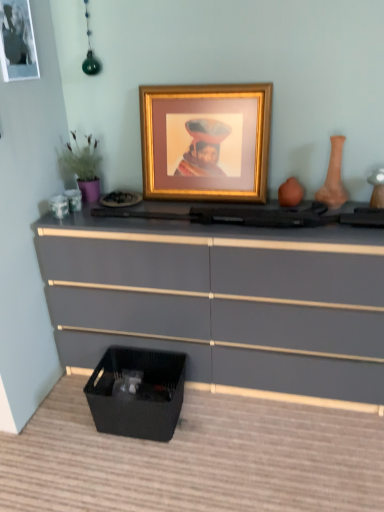
Image resolution: width=384 pixels, height=512 pixels. I want to click on unoccupied region to the right of black woven basket at lower left, so click(216, 420).